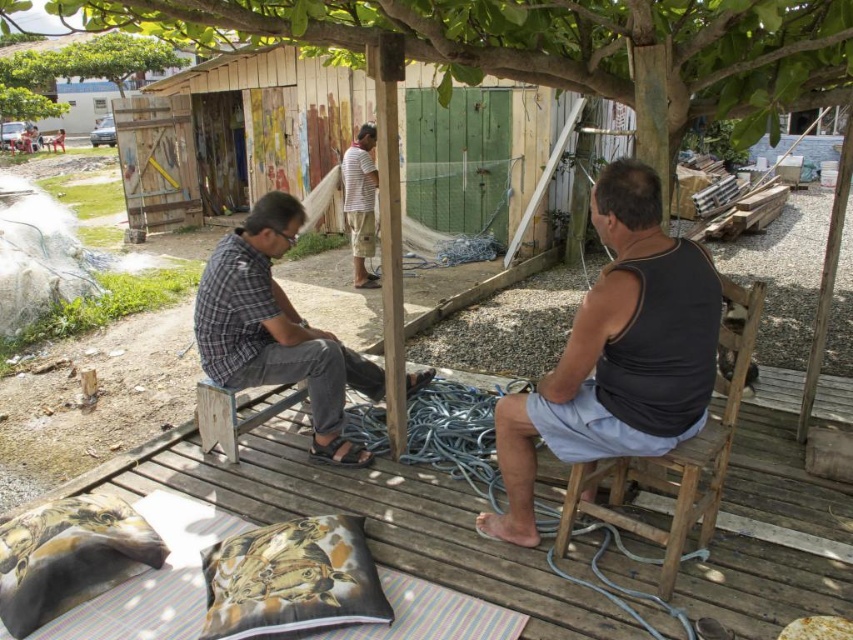
Who is taller, wooden deck at center or green leafy tree at upper left?

Standing taller between the two is green leafy tree at upper left.

Is point (726, 586) in front of point (141, 42)?

Yes, it is.

You are a GUI agent. You are given a task and a screenshot of the screen. Output one action in this format:
    pyautogui.click(x=<x>, y=<y>)
    Task: Click on the wooden deck at center
    This screenshot has height=640, width=853.
    Given the screenshot: What is the action you would take?
    pyautogui.click(x=376, y=520)

The width and height of the screenshot is (853, 640). I want to click on wooden deck at center, so click(376, 520).

Who is higher up, plaid fabric shirt at left or printed fabric pillow at lower left?

plaid fabric shirt at left

Find the location of a particular element. plaid fabric shirt at left is located at coordinates (276, 328).

Who is taller, plaid fabric shirt at left or striped cotton shirt at center?

striped cotton shirt at center

Can you confirm if plaid fabric shirt at left is positioned to the left of striped cotton shirt at center?

No, plaid fabric shirt at left is not to the left of striped cotton shirt at center.

Is point (264, 340) positioned after point (363, 228)?

That is False.

The height and width of the screenshot is (640, 853). What are the coordinates of `plaid fabric shirt at left` in the screenshot? It's located at (276, 328).